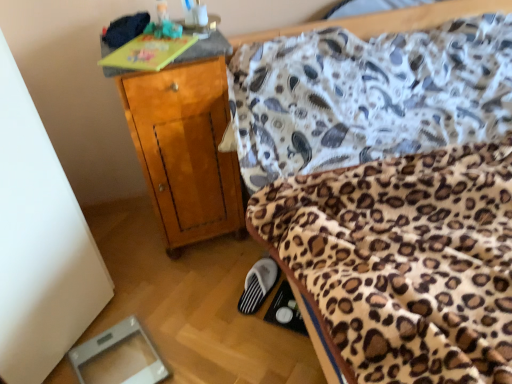
At what (x,y) coordinates should I click in order to perform the action: click on free space to the left of wooden nightstand at upper left. Please return your answer as a coordinate pair (x, y). This screenshot has width=512, height=384. Looking at the image, I should click on (127, 240).